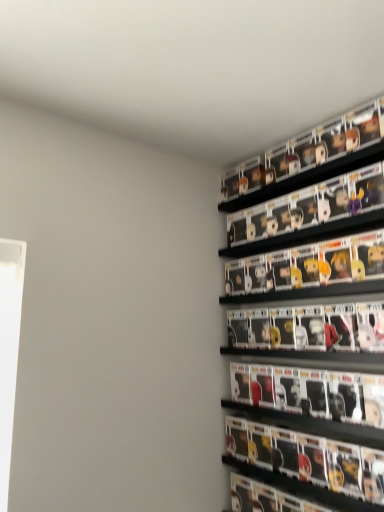
Question: From the image's perspective, is matt black figurines at upper right, the first shelf in the bottom-to-top sequence, located above or below matte black figure at right?

Choices:
 (A) below
 (B) above

Answer: (B)

Question: Which is correct: matt black figurines at upper right, positioned as the second shelf in top-to-bottom order, is inside matte black figure at right, or outside of it?

Choices:
 (A) inside
 (B) outside

Answer: (B)

Question: Considering the real-world distances, which object is farthest from the matt black figurines at upper right, the first shelf in the bottom-to-top sequence?

Choices:
 (A) matte black figure at right
 (B) black plastic shelf at upper right, positioned as the first shelf in top-to-bottom order

Answer: (A)

Question: Which is farther from the matt black figurines at upper right, the first shelf in the bottom-to-top sequence?

Choices:
 (A) matte black figure at right
 (B) black plastic shelf at upper right, positioned as the first shelf in top-to-bottom order

Answer: (A)